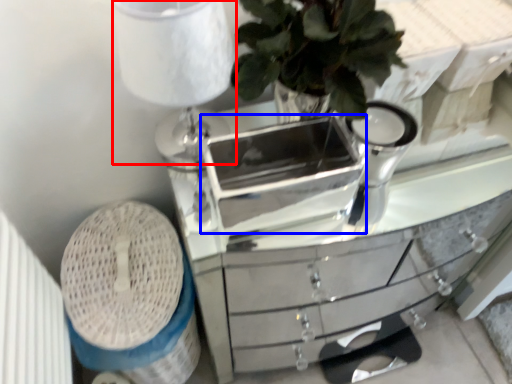
Question: Which of the following is the closest to the observer, table lamp (highlighted by a red box) or appliance (highlighted by a blue box)?

Choices:
 (A) table lamp
 (B) appliance

Answer: (A)